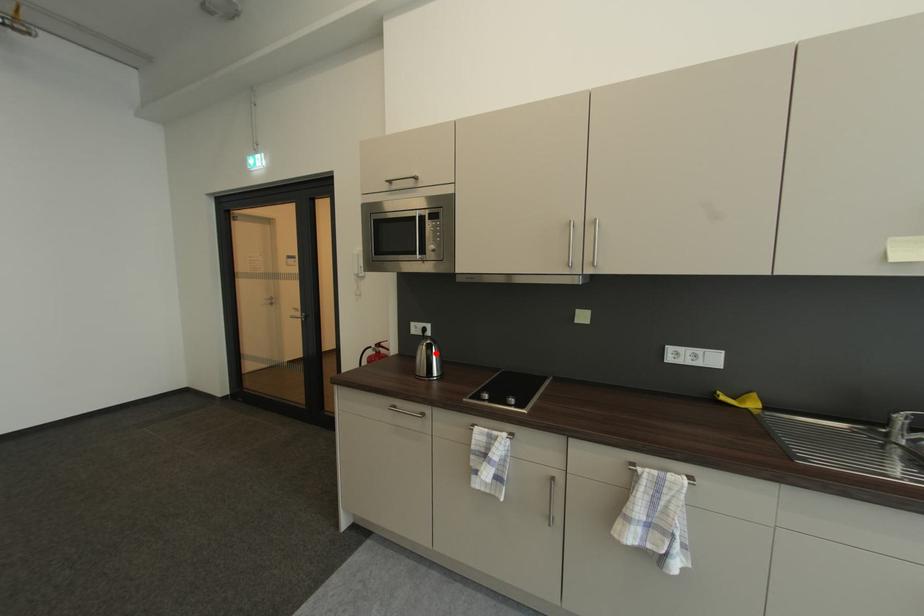
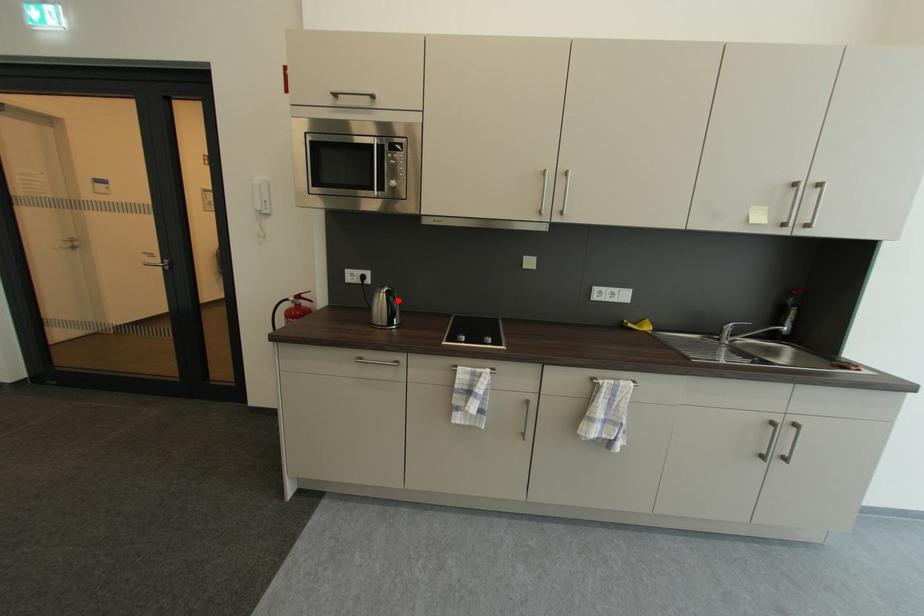
I am providing you with two images of the same scene from different viewpoints. A red point is marked on the first image and another point is marked on the second image. Do the highlighted points in image1 and image2 indicate the same real-world spot?

Yes